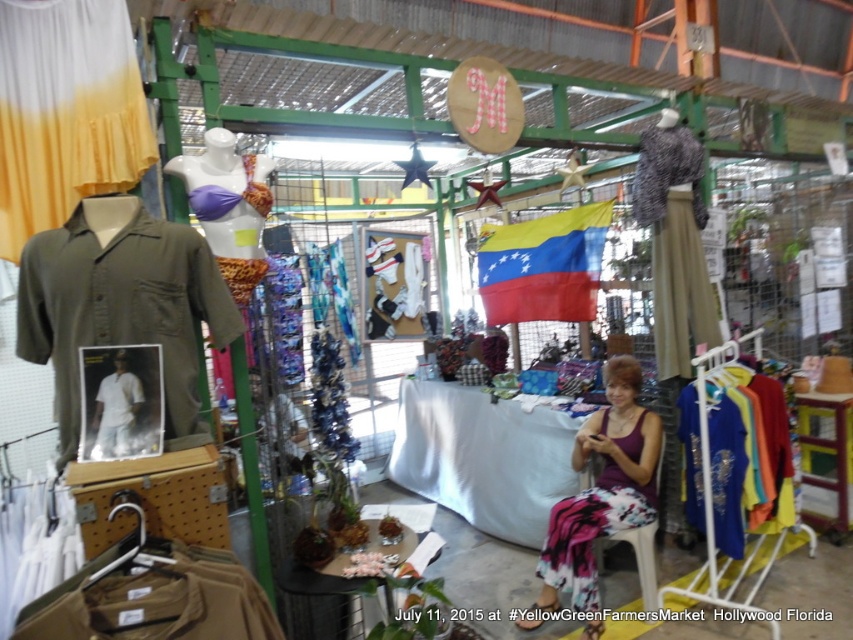
Who is taller, tan cotton shirt at lower left or white cotton shirt at center?

tan cotton shirt at lower left is taller.

How much distance is there between tan cotton shirt at lower left and white cotton shirt at center?

tan cotton shirt at lower left and white cotton shirt at center are 16.00 inches apart.

Does point (177, 600) lie in front of point (114, 456)?

Yes, point (177, 600) is closer to viewer.

Locate an element on the screen. The height and width of the screenshot is (640, 853). tan cotton shirt at lower left is located at coordinates (154, 598).

How far apart are olive green fabric shirt at left and white cotton shirt at center?

olive green fabric shirt at left and white cotton shirt at center are 9.33 inches apart from each other.

Who is positioned more to the right, olive green fabric shirt at left or white cotton shirt at center?

white cotton shirt at center is more to the right.

This screenshot has width=853, height=640. I want to click on olive green fabric shirt at left, so click(120, 305).

Describe the element at coordinates (154, 598) in the screenshot. This screenshot has height=640, width=853. I see `tan cotton shirt at lower left` at that location.

Is tan cotton shirt at lower left shorter than camouflage-patterned fabric skirt at upper right?

Yes.

Which is behind, point (82, 568) or point (682, 150)?

The point (682, 150) is more distant.

At what (x,y) coordinates should I click in order to perform the action: click on tan cotton shirt at lower left. Please return your answer as a coordinate pair (x, y). Looking at the image, I should click on (154, 598).